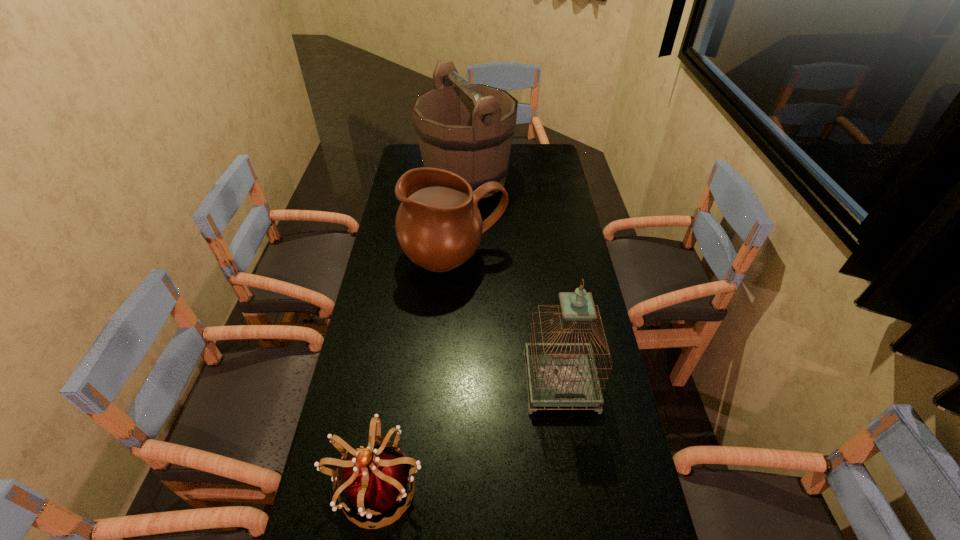
This screenshot has width=960, height=540. I want to click on the farthest object, so coord(467,129).

Locate an element on the screen. the second nearest object is located at coordinates click(560, 374).

Where is `cream pitcher`? The width and height of the screenshot is (960, 540). cream pitcher is located at coordinates (438, 224).

You are a GUI agent. You are given a task and a screenshot of the screen. Output one action in this format:
    pyautogui.click(x=<x>, y=<y>)
    Task: Click on the second farthest object
    This screenshot has width=960, height=540.
    Given the screenshot: What is the action you would take?
    pyautogui.click(x=438, y=224)

Identify the location of the shortest object. This screenshot has height=540, width=960. click(x=375, y=482).

The image size is (960, 540). In order to click on the nearest object in this screenshot , I will do `click(375, 482)`.

Identify the location of free space located on the front of the bucket. This screenshot has height=540, width=960. (466, 221).

Find the location of a particular element. This screenshot has width=960, height=540. vacant space situated at the door of the third farthest object is located at coordinates (578, 505).

Find the location of `free space located at the spout of the second farthest object`. free space located at the spout of the second farthest object is located at coordinates (450, 310).

I want to click on object located at the far edge, so click(467, 129).